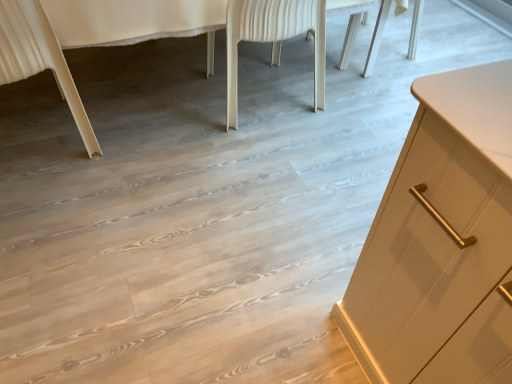
At what (x,y) coordinates should I click in order to perform the action: click on free spot in front of white wood chair at center, which appears as the second chair when viewed from the left. Please return your answer as a coordinate pair (x, y). This screenshot has height=384, width=512. Looking at the image, I should click on (245, 153).